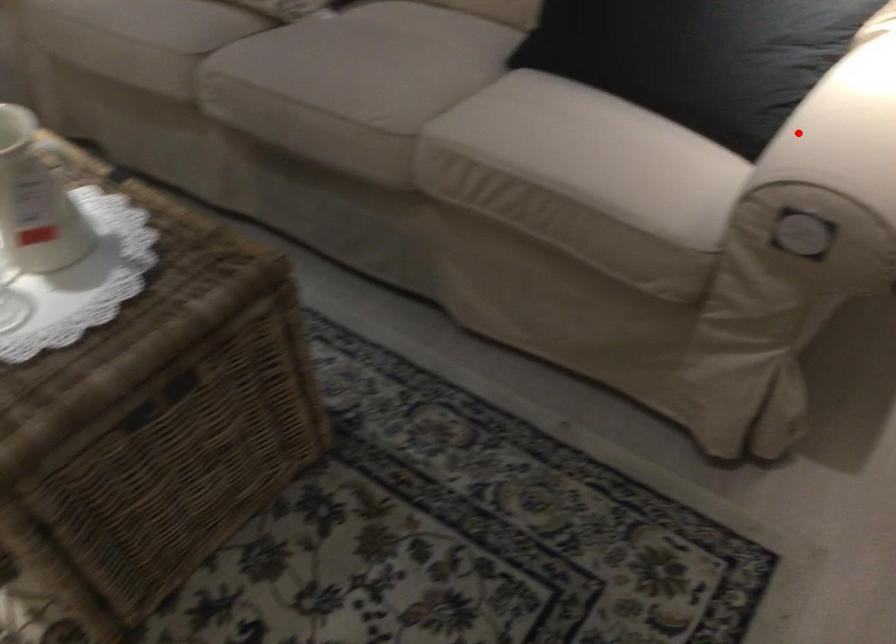
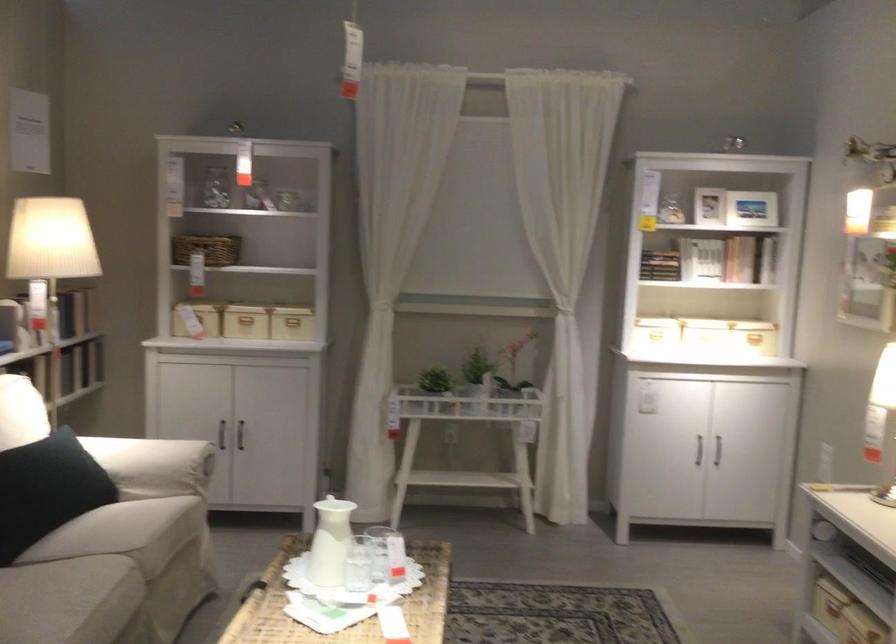
Question: I am providing you with two images of the same scene from different viewpoints. Given a red point in image1, look at the same physical point in image2. Is it:

Choices:
 (A) Closer to the viewpoint
 (B) Farther from the viewpoint

Answer: (B)